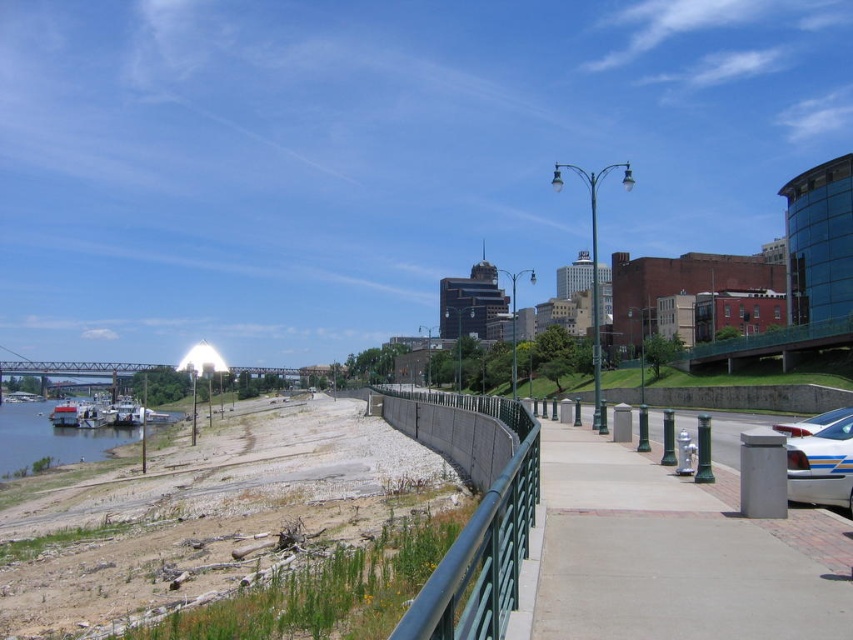
Question: Based on their relative distances, which object is nearer to the metallic blue car at right?

Choices:
 (A) smooth concrete river at lower left
 (B) metallic steel bridge at left
 (C) white glossy car at lower right

Answer: (C)

Question: Which of the following is the closest to the observer?

Choices:
 (A) (62, 417)
 (B) (231, 374)
 (C) (833, 410)
 (D) (48, 410)

Answer: (C)

Question: Is metallic steel bridge at left behind white plastic boat at lower left?

Choices:
 (A) no
 (B) yes

Answer: (B)

Question: Does smooth concrete river at lower left appear on the right side of white glossy car at lower right?

Choices:
 (A) no
 (B) yes

Answer: (A)

Question: Which point appears closest to the camera in this image?

Choices:
 (A) (582, 538)
 (B) (59, 448)
 (C) (86, 410)

Answer: (A)

Question: Is white glossy car at lower right below white plastic boat at lower left?

Choices:
 (A) no
 (B) yes

Answer: (A)